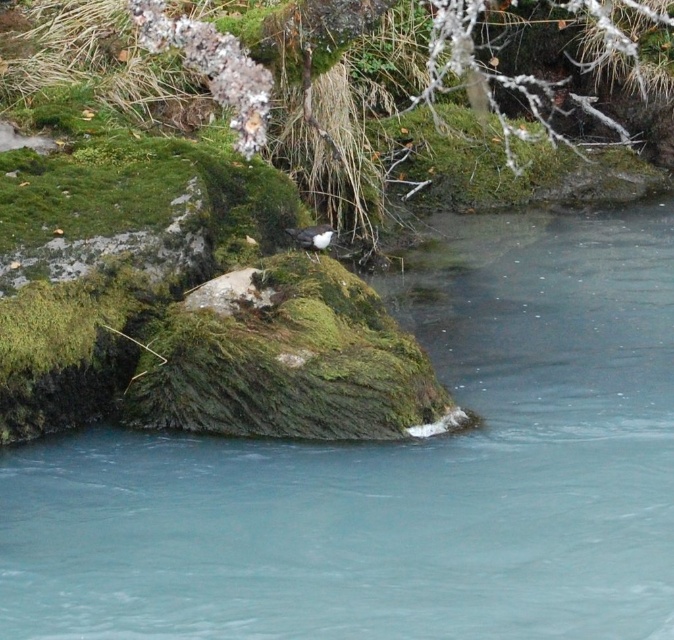
You are a birdwatcher trying to observe the bird on the green mossy rock at center. You have a camera with a zoom lens that can focus up to 3 meters. Can you capture a clear image of the bird from your current position near the clear blue water at center without moving closer?

The clear blue water at center is 3.07 meters from the green mossy rock at center. Since the camera can focus up to 3 meters, the distance is slightly beyond its range. Therefore, you cannot capture a clear image without moving closer.

You are standing at the edge of the water and see the point marked at coordinates point (398, 472). Based on the scene description, can you determine if this point is located on the clear blue water at center?

Yes, the point (398, 472) is on clear blue water at center according to the Objects Description.

You are a birder observing the scene. You notice the clear blue water at center and the green mossy rock at center. Which object is located to the right of the other?

The green mossy rock at center is to the right of the clear blue water at center.